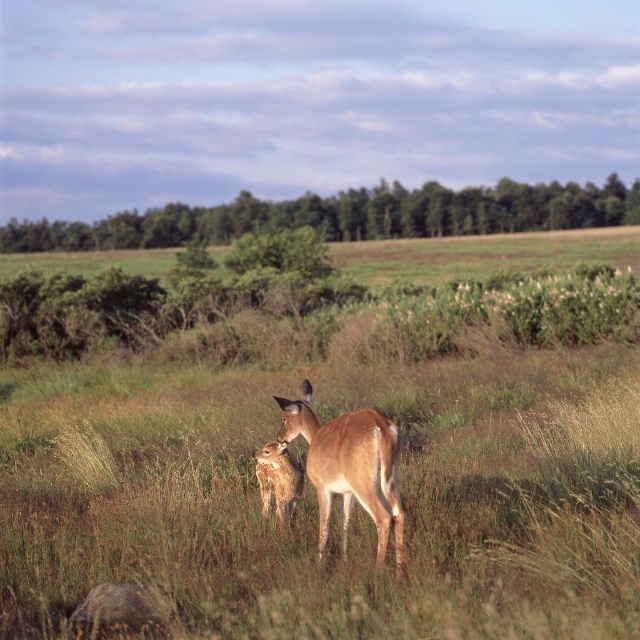
Who is positioned more to the left, brown matte/deer at center or brown fur antelope at center?

From the viewer's perspective, brown fur antelope at center appears more on the left side.

Can you confirm if brown matte/deer at center is taller than brown fur antelope at center?

Yes.

Where is `brown matte/deer at center`? This screenshot has width=640, height=640. brown matte/deer at center is located at coordinates (348, 467).

Does green grassy at center come behind brown fur antelope at center?

No, it is in front of brown fur antelope at center.

Does green grassy at center have a lesser height compared to brown fur antelope at center?

Incorrect, green grassy at center's height does not fall short of brown fur antelope at center's.

Does point (189, 428) come in front of point (276, 461)?

No, (189, 428) is further to viewer.

This screenshot has width=640, height=640. Find the location of `green grassy at center`. green grassy at center is located at coordinates (337, 499).

Is point (208, 465) less distant than point (339, 420)?

No, (208, 465) is further to viewer.

Can you confirm if green grassy at center is positioned below brown matte/deer at center?

No, green grassy at center is not below brown matte/deer at center.

Between point (97, 381) and point (344, 513), which one is positioned behind?

Point (97, 381)

Where is `green grassy at center`? The width and height of the screenshot is (640, 640). green grassy at center is located at coordinates (337, 499).